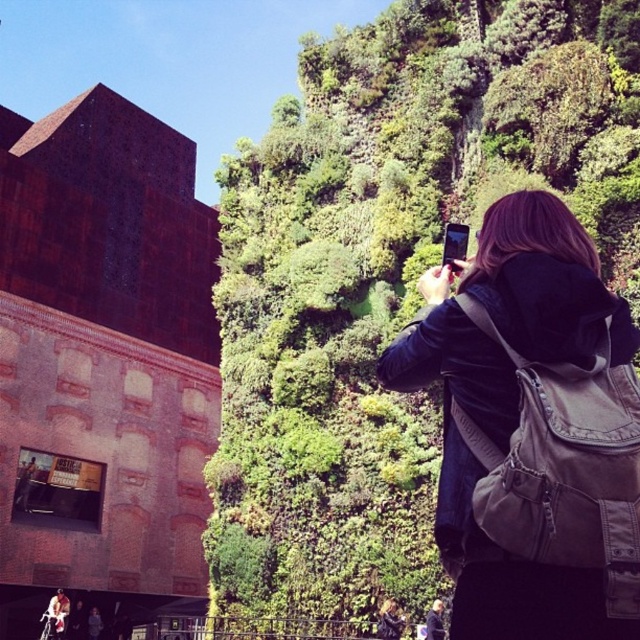
Based on the photo, you are standing in an urban area and want to take a photo of the green leafy wall at upper center. If your camera has a maximum focus range of 50 feet, will you be able to capture the wall clearly?

The green leafy wall at upper center is 57.22 feet away from the viewer. Since the camera can only focus up to 50 feet, it won camera will not be able to capture the wall clearly due to being out of focus range.

You are a photographer trying to capture the entire green leafy wall at upper center and the dark brown leather jacket at upper right in one frame. Based on their widths, which object will require you to zoom out more to include both in the frame?

The green leafy wall at upper center has a greater width than the dark brown leather jacket at upper right, so you will need to zoom out more to include both in the frame because the green leafy wall at upper center is wider.

You are standing in the middle of the scene and want to take a photo of the green leafy wall at upper center. According to the coordinates provided, where should you aim your camera to capture it?

The green leafy wall at upper center is located at coordinates point [388,273], so you should aim your camera towards that position to capture it.